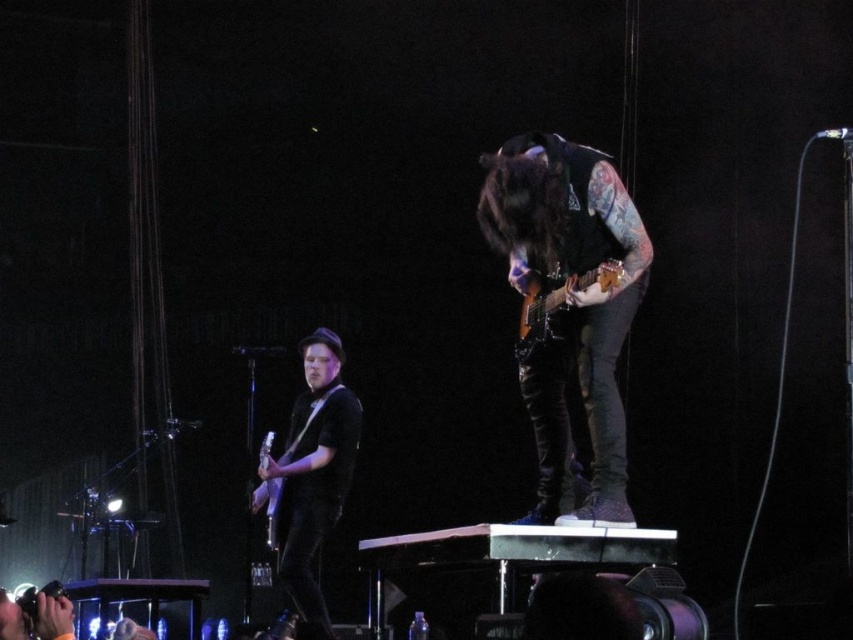
From the picture: Based on the scene description, which guitar is positioned to the right of the other between the matte black guitar at left and the matte silver guitar at center?

The matte black guitar at left is positioned to the right of the matte silver guitar at center.

You are a stagehand setting up microphones for the two guitars. The shiny black guitar at center is currently placed closer to the edge of the stage. The matte black guitar at left is positioned further back. If you want to place a microphone stand between them, which guitar should you place it closer to to ensure it doesn

The shiny black guitar at center is smaller than the matte black guitar at left, so placing the microphone stand closer to the shiny black guitar at center would allow for better positioning between the two guitars.

You are a photographer at the concert venue. You need to capture a photo that includes both the shiny black guitar at center and the matte black guitar at left. Based on their positions, which guitar should be positioned on the left side of the photo to ensure both are visible?

The matte black guitar at left should be positioned on the left side of the photo since the shiny black guitar at center is already to its right, ensuring both guitars are visible in the frame.